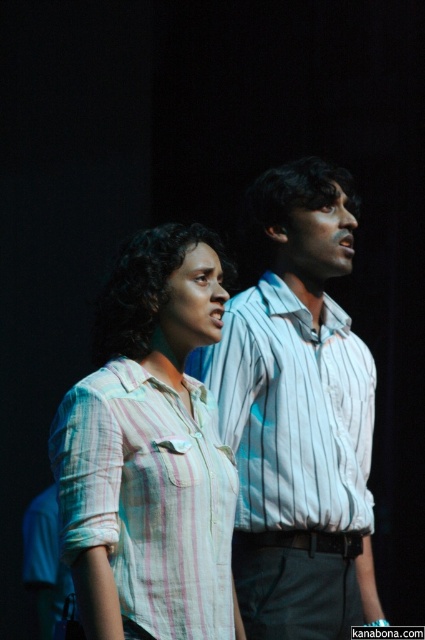
You are a costume designer preparing for a play. You need to ensure that the white striped shirt at center and the light pink striped shirt at center are visible to the audience. Given their height difference, which shirt might be more easily seen from the back row seats?

The white striped shirt at center is much taller than the light pink striped shirt at center, so it would be more easily seen from the back row seats due to its greater height.

In the scene shown: You are a photographer adjusting your camera settings to focus on the white striped shirt at center and the light pink striped shirt at center. Which shirt should you focus on first to ensure it appears sharp in the photo?

The white striped shirt at center is closer to the viewer than the light pink striped shirt at center, so you should focus on the white striped shirt at center first to ensure it appears sharp in the photo.